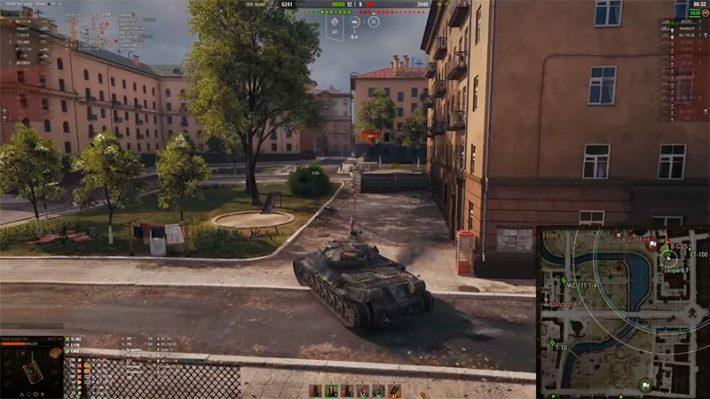
The width and height of the screenshot is (710, 399). I want to click on brick wall, so click(x=544, y=206), click(x=475, y=199).